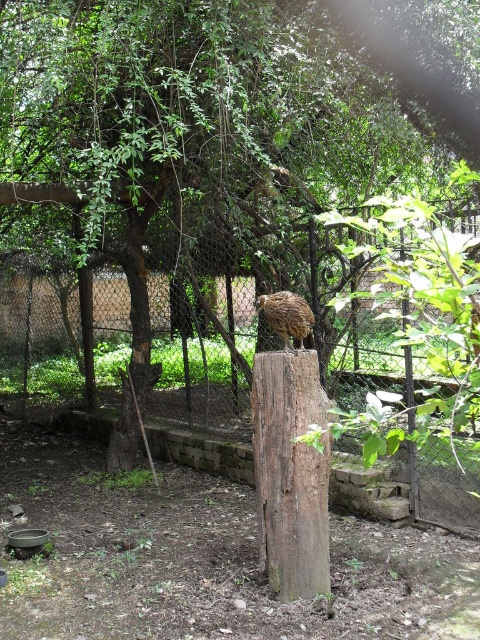
Question: Does brown rough wood post at center appear over brown feathered bird at center?

Choices:
 (A) yes
 (B) no

Answer: (B)

Question: Which point is farther to the camera?

Choices:
 (A) brown rough wood post at center
 (B) brown feathered bird at center

Answer: (B)

Question: Which point is farther from the camera taking this photo?

Choices:
 (A) (271, 584)
 (B) (467, 484)

Answer: (B)

Question: Which object is positioned closest to the metal mesh fence at center?

Choices:
 (A) brown feathered bird at center
 (B) brown rough wood post at center

Answer: (B)

Question: In this image, where is brown rough wood post at center located relative to brown feathered bird at center?

Choices:
 (A) left
 (B) right

Answer: (B)

Question: Is brown rough wood post at center wider than metal mesh fence at center?

Choices:
 (A) no
 (B) yes

Answer: (A)